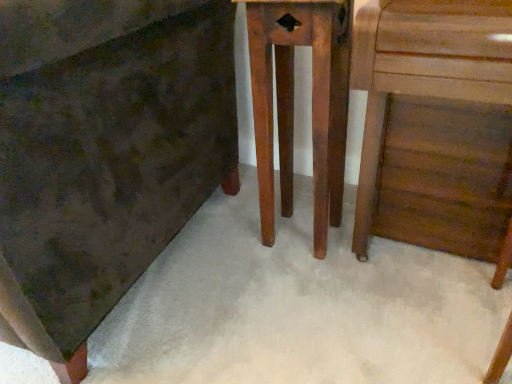
Question: From a real-world perspective, is wooden chest of drawers at center on top of wooden table at center?

Choices:
 (A) yes
 (B) no

Answer: (A)

Question: Is wooden chest of drawers at center looking in the opposite direction of wooden table at center?

Choices:
 (A) yes
 (B) no

Answer: (B)

Question: Considering the relative positions of wooden chest of drawers at center and wooden table at center in the image provided, is wooden chest of drawers at center to the right of wooden table at center from the viewer's perspective?

Choices:
 (A) yes
 (B) no

Answer: (B)

Question: Would you say wooden table at center is part of wooden chest of drawers at center's contents?

Choices:
 (A) no
 (B) yes

Answer: (A)

Question: Considering the relative positions of wooden chest of drawers at center and wooden table at center in the image provided, is wooden chest of drawers at center to the left of wooden table at center from the viewer's perspective?

Choices:
 (A) yes
 (B) no

Answer: (A)

Question: Is wooden chest of drawers at center positioned before wooden table at center?

Choices:
 (A) no
 (B) yes

Answer: (B)

Question: Considering the relative sizes of wooden table at center and wooden chest of drawers at center in the image provided, is wooden table at center bigger than wooden chest of drawers at center?

Choices:
 (A) yes
 (B) no

Answer: (B)

Question: From the image's perspective, is wooden table at center under wooden chest of drawers at center?

Choices:
 (A) yes
 (B) no

Answer: (A)

Question: Is wooden chest of drawers at center located within wooden table at center?

Choices:
 (A) yes
 (B) no

Answer: (B)

Question: Is there a large distance between wooden table at center and wooden chest of drawers at center?

Choices:
 (A) no
 (B) yes

Answer: (A)

Question: Is wooden table at center further to camera compared to wooden chest of drawers at center?

Choices:
 (A) no
 (B) yes

Answer: (B)

Question: From a real-world perspective, is wooden table at center beneath wooden chest of drawers at center?

Choices:
 (A) no
 (B) yes

Answer: (B)

Question: In the image, is wooden chest of drawers at center positioned in front of or behind wooden table at center?

Choices:
 (A) front
 (B) behind

Answer: (A)